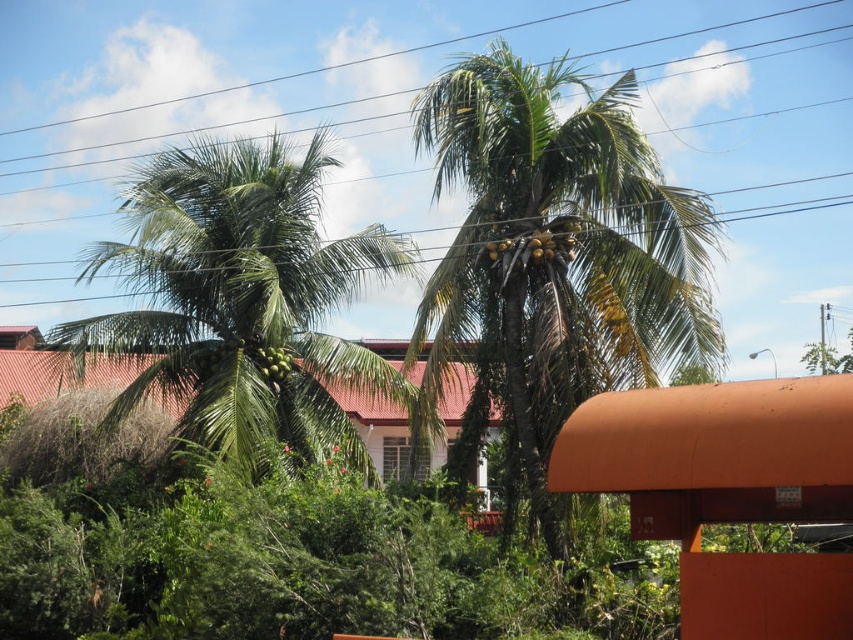
You are standing at the origin point in the image and want to walk towards the point labeled point (177, 342). As you walk, will the point labeled point (672, 38) become visible or obscured?

The point labeled point (672, 38) is behind point (177, 342), so as you walk towards point (177, 342), the point labeled point (672, 38) will become obscured by it.

You are a bird flying at an altitude of 5 meters. You want to land on the closest object between the metallic wire at upper center and the green leafy palm at center. Which object should you choose?

The metallic wire at upper center is 7.45 meters away from the green leafy palm at center. Since you are flying at 5 meters altitude, the metallic wire at upper center is closer to you than the green leafy palm at center, so you should choose the metallic wire at upper center to land on.

You are a botanist studying the palm trees in this tropical scene. You need to determine which of the two trees, the green leafy palm at center or the green leafy coconut tree at left, is the smaller one. Can you identify it?

The green leafy palm at center is smaller than the green leafy coconut tree at left.